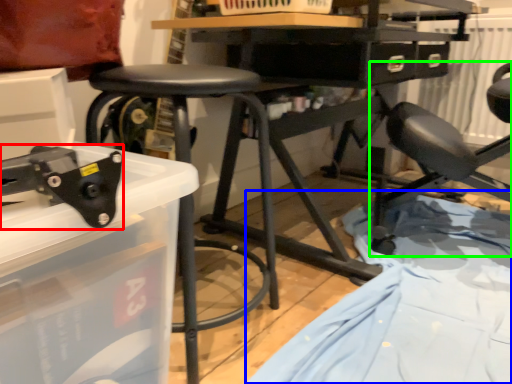
Question: Estimate the real-world distances between objects in this image. Which object is closer to tool (highlighted by a red box), sheet (highlighted by a blue box) or chair (highlighted by a green box)?

Choices:
 (A) sheet
 (B) chair

Answer: (A)